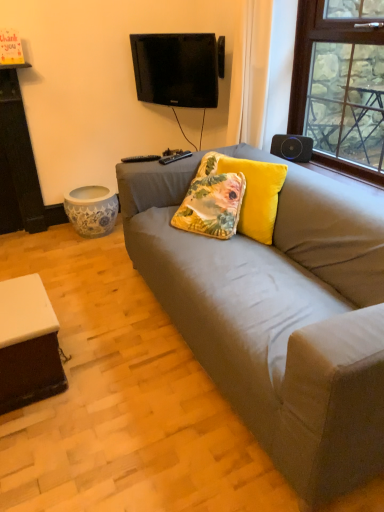
Question: Does black glossy tv at upper center have a lesser height compared to floral fabric pillow at center, the 1th pillow positioned from the left?

Choices:
 (A) no
 (B) yes

Answer: (A)

Question: Is black glossy tv at upper center to the left of floral fabric pillow at center, positioned as the second pillow in right-to-left order, from the viewer's perspective?

Choices:
 (A) yes
 (B) no

Answer: (A)

Question: Does black glossy tv at upper center have a lesser width compared to floral fabric pillow at center, the 1th pillow positioned from the left?

Choices:
 (A) no
 (B) yes

Answer: (B)

Question: From a real-world perspective, is black glossy tv at upper center physically below floral fabric pillow at center, the 1th pillow positioned from the left?

Choices:
 (A) yes
 (B) no

Answer: (B)

Question: Is black glossy tv at upper center looking in the opposite direction of floral fabric pillow at center, the 1th pillow positioned from the left?

Choices:
 (A) no
 (B) yes

Answer: (A)

Question: Is point (132, 33) positioned closer to the camera than point (3, 315)?

Choices:
 (A) farther
 (B) closer

Answer: (A)

Question: From a real-world perspective, is black glossy tv at upper center above or below white matte table at lower left?

Choices:
 (A) above
 (B) below

Answer: (A)

Question: Would you say black glossy tv at upper center is to the left or to the right of white matte table at lower left in the picture?

Choices:
 (A) left
 (B) right

Answer: (B)

Question: Is black glossy tv at upper center inside or outside of white matte table at lower left?

Choices:
 (A) inside
 (B) outside

Answer: (B)

Question: Visually, is white matte table at lower left positioned to the left or to the right of velvet yellow pillow at center, positioned as the 2th pillow in left-to-right order?

Choices:
 (A) left
 (B) right

Answer: (A)

Question: From a real-world perspective, is white matte table at lower left positioned above or below velvet yellow pillow at center, positioned as the 2th pillow in left-to-right order?

Choices:
 (A) above
 (B) below

Answer: (B)

Question: Is white matte table at lower left in front of or behind velvet yellow pillow at center, positioned as the 2th pillow in left-to-right order, in the image?

Choices:
 (A) behind
 (B) front

Answer: (B)

Question: From the image's perspective, is white matte table at lower left located above or below velvet yellow pillow at center, positioned as the 2th pillow in left-to-right order?

Choices:
 (A) above
 (B) below

Answer: (B)

Question: Is black matte speaker at upper right in front of or behind matte gray couch at center in the image?

Choices:
 (A) behind
 (B) front

Answer: (A)

Question: Considering the positions of black matte speaker at upper right and matte gray couch at center in the image, is black matte speaker at upper right bigger or smaller than matte gray couch at center?

Choices:
 (A) big
 (B) small

Answer: (B)